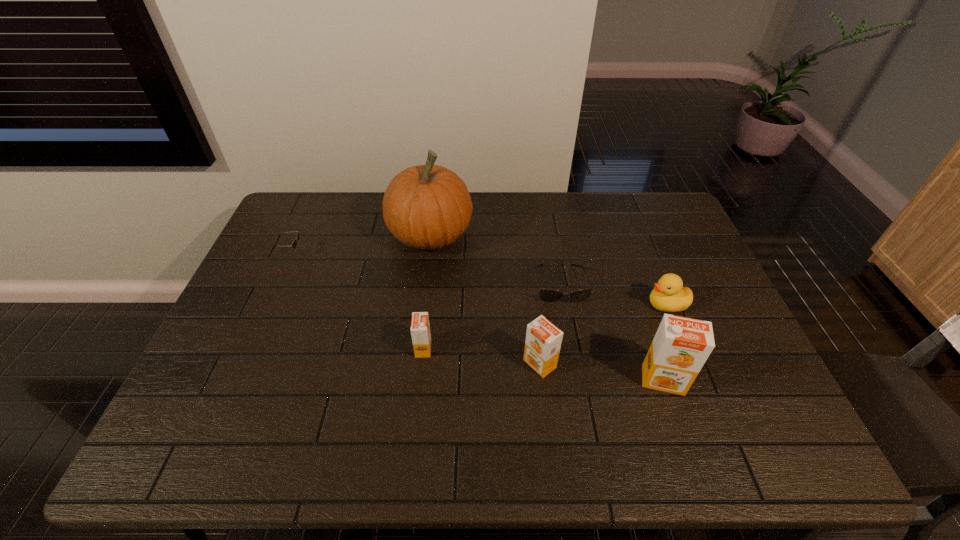
The image size is (960, 540). What are the coordinates of `the second closest orange juice to the rightmost orange juice` in the screenshot? It's located at (420, 328).

You are a GUI agent. You are given a task and a screenshot of the screen. Output one action in this format:
    pyautogui.click(x=<x>, y=<y>)
    Task: Click on the vacant space that satisfies the following two spatial constraints: 1. in front of the lenses of the second tallest orange juice; 2. on the right side of the sixth tallest object
    The width and height of the screenshot is (960, 540).
    Given the screenshot: What is the action you would take?
    click(242, 364)

The height and width of the screenshot is (540, 960). What are the coordinates of `free location that satisfies the following two spatial constraints: 1. in front of the lenses of the leftmost object; 2. on the left side of the tallest orange juice` in the screenshot? It's located at (234, 380).

This screenshot has height=540, width=960. I want to click on free space in the image that satisfies the following two spatial constraints: 1. on the stem of the tallest orange juice; 2. on the left side of the pumpkin, so click(413, 380).

Find the location of a particular element. This screenshot has width=960, height=540. vacant space that satisfies the following two spatial constraints: 1. on the back side of the second orange juice from left to right; 2. in front of the lenses of the left sunglasses is located at coordinates (527, 254).